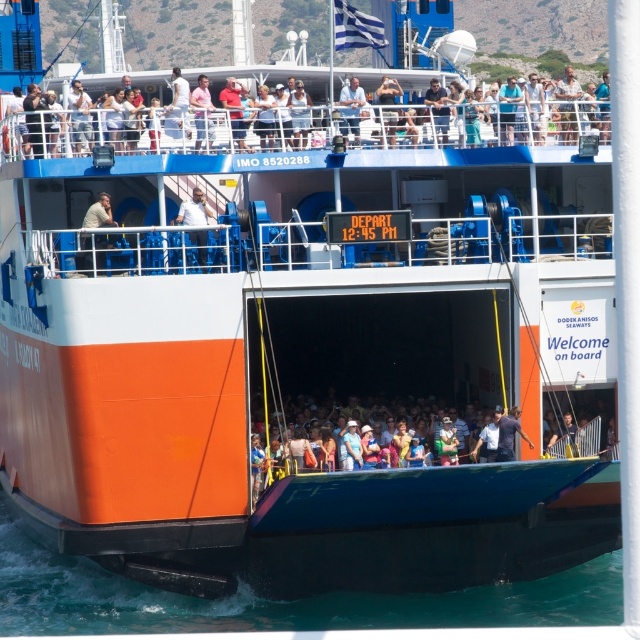
Is light brown leather jacket at upper center closer to the viewer compared to light blue denim shirt at upper center?

Yes, it is.

Locate an element on the screen. The height and width of the screenshot is (640, 640). light brown leather jacket at upper center is located at coordinates (99, 212).

Between matte blue shirt at center and pink fabric shirt at upper center, which one has more height?

With more height is matte blue shirt at center.

Locate an element on the screen. matte blue shirt at center is located at coordinates (403, 429).

Where is `matte blue shirt at center`? matte blue shirt at center is located at coordinates (403, 429).

Who is taller, light brown leather jacket at upper center or pink fabric shirt at upper center?

With more height is pink fabric shirt at upper center.

From the picture: Can you confirm if light brown leather jacket at upper center is taller than pink fabric shirt at upper center?

No.

Is point (102, 193) positioned after point (211, 131)?

Yes, it is.

Where is `light brown leather jacket at upper center`? Image resolution: width=640 pixels, height=640 pixels. light brown leather jacket at upper center is located at coordinates (99, 212).